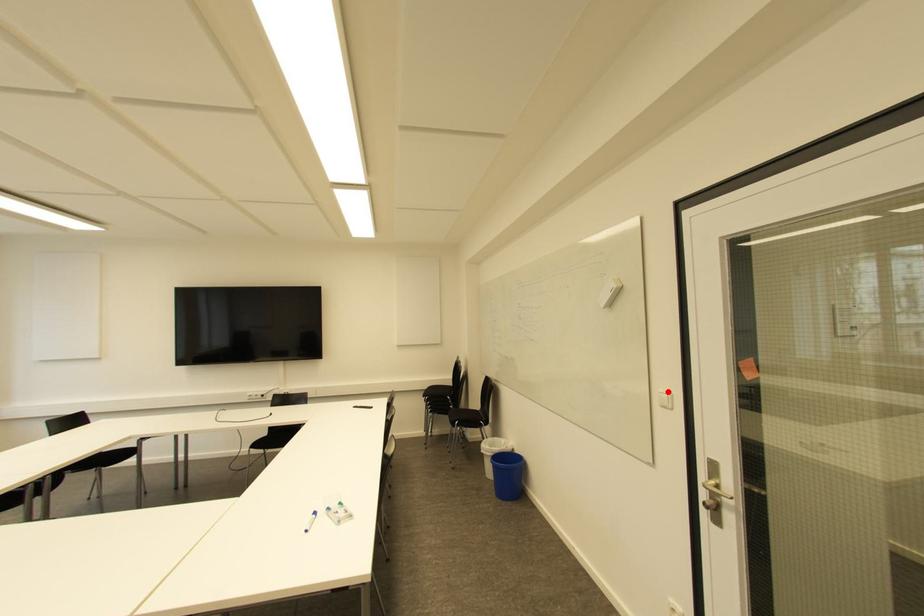
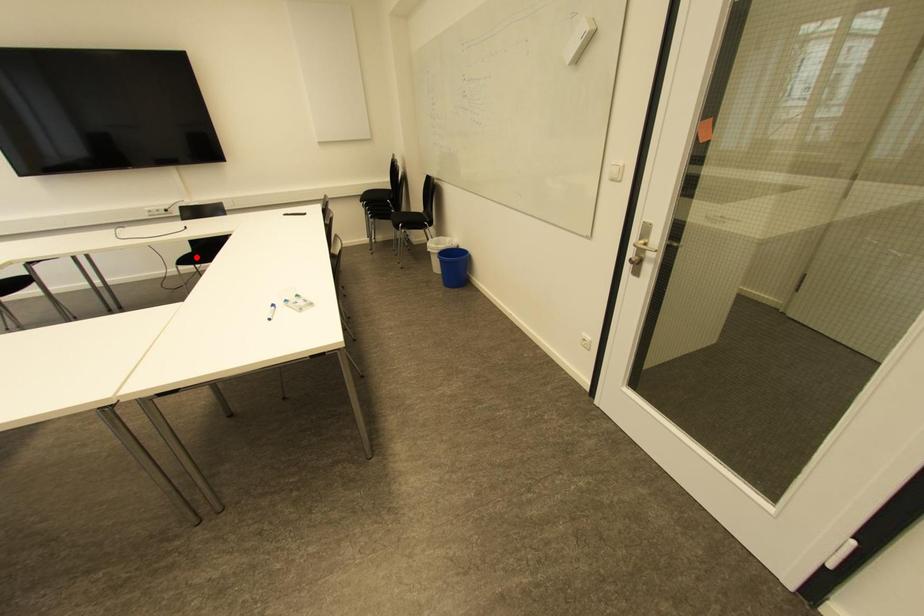
I am providing you with two images of the same scene from different viewpoints. A red point is marked on the first image and another point is marked on the second image. Are the points marked in image1 and image2 representing the same 3D position?

No